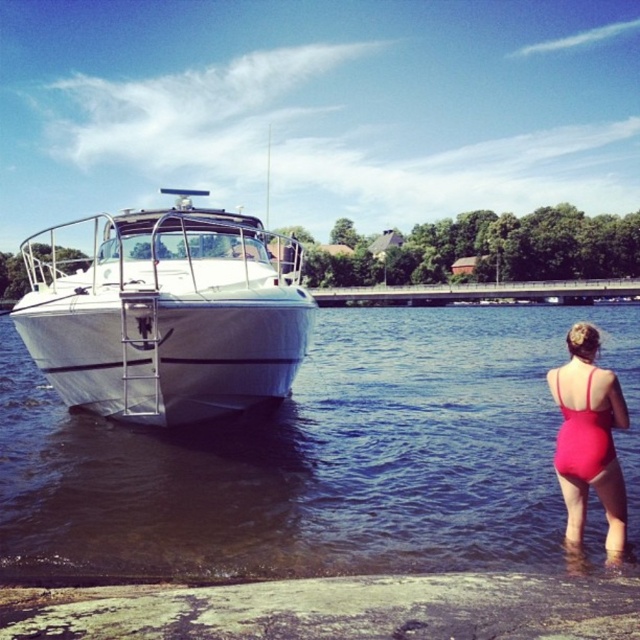
Question: Which of the following is the closest to the observer?

Choices:
 (A) (264, 465)
 (B) (257, 352)
 (C) (292, 632)

Answer: (C)

Question: Does smooth concrete shore at lower center come behind matte red swimsuit at lower right?

Choices:
 (A) yes
 (B) no

Answer: (B)

Question: Can you confirm if smooth concrete shore at lower center is bigger than matte red swimsuit at lower right?

Choices:
 (A) no
 (B) yes

Answer: (B)

Question: Considering the real-world distances, which object is farthest from the smooth concrete shore at lower center?

Choices:
 (A) matte red swimsuit at lower right
 (B) white glossy boat at left

Answer: (B)

Question: Which is farther from the clear water at boat right?

Choices:
 (A) matte red swimsuit at lower right
 (B) white glossy boat at left
 (C) smooth concrete shore at lower center

Answer: (A)

Question: Does white glossy boat at left come in front of smooth concrete shore at lower center?

Choices:
 (A) no
 (B) yes

Answer: (A)